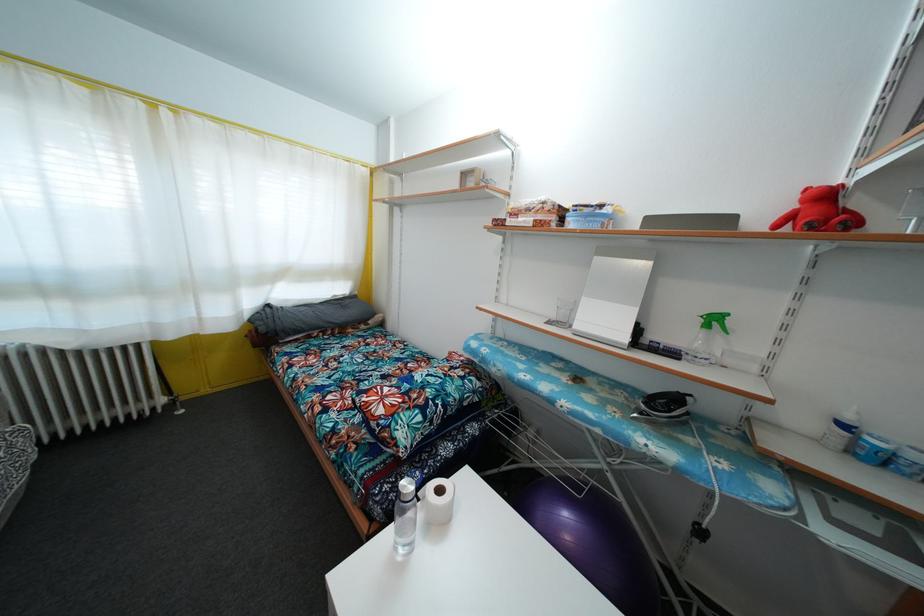
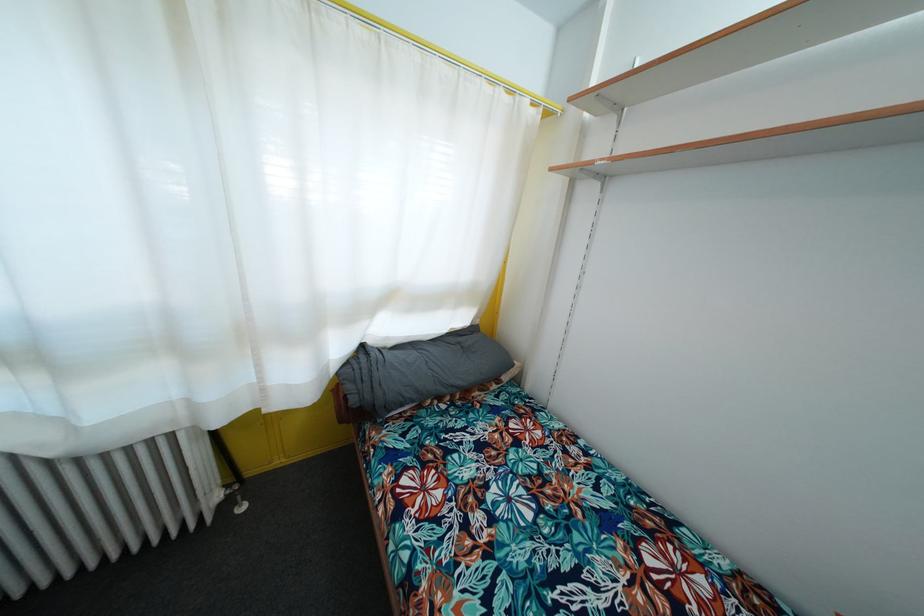
Locate, in the second image, the point that corresponds to pixel 178 416 in the first image.

(240, 511)